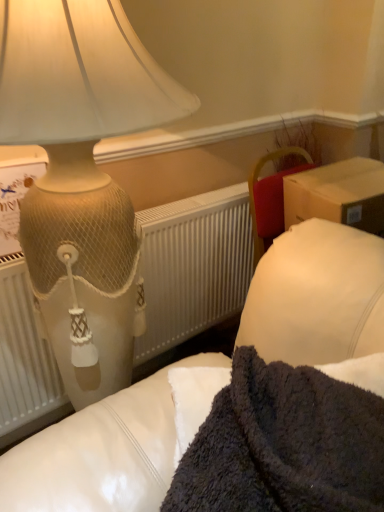
Question: Looking at their shapes, would you say dark fuzzy blanket at lower right is wider or thinner than matte cream lamp at upper left?

Choices:
 (A) thin
 (B) wide

Answer: (A)

Question: Considering the positions of dark fuzzy blanket at lower right and matte cream lamp at upper left in the image, is dark fuzzy blanket at lower right taller or shorter than matte cream lamp at upper left?

Choices:
 (A) short
 (B) tall

Answer: (A)

Question: Estimate the real-world distances between objects in this image. Which object is farther from the dark fuzzy blanket at lower right?

Choices:
 (A) matte cream lamp at upper left
 (B) white textured radiator at left

Answer: (B)

Question: Which is farther from the matte cream lamp at upper left?

Choices:
 (A) dark fuzzy blanket at lower right
 (B) white textured radiator at left

Answer: (A)